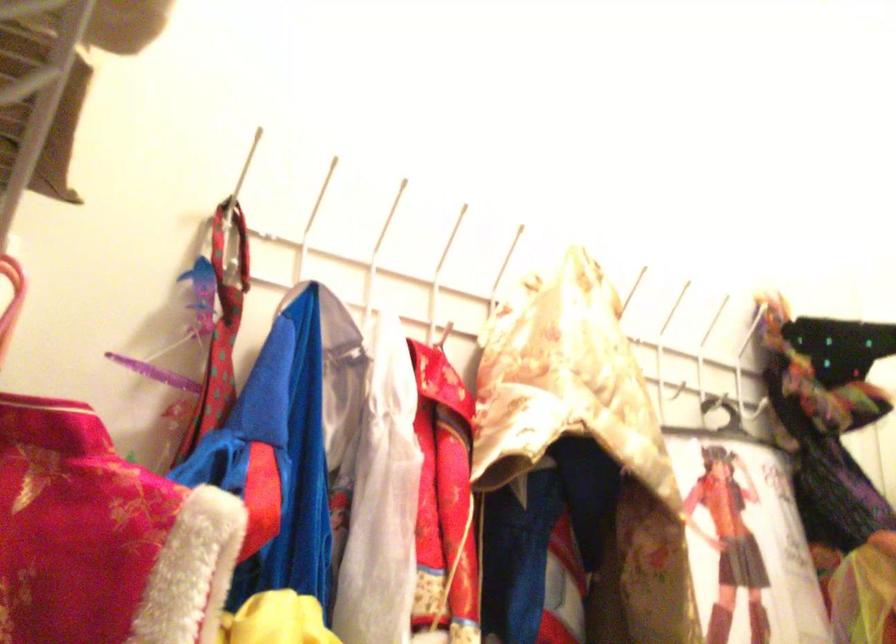
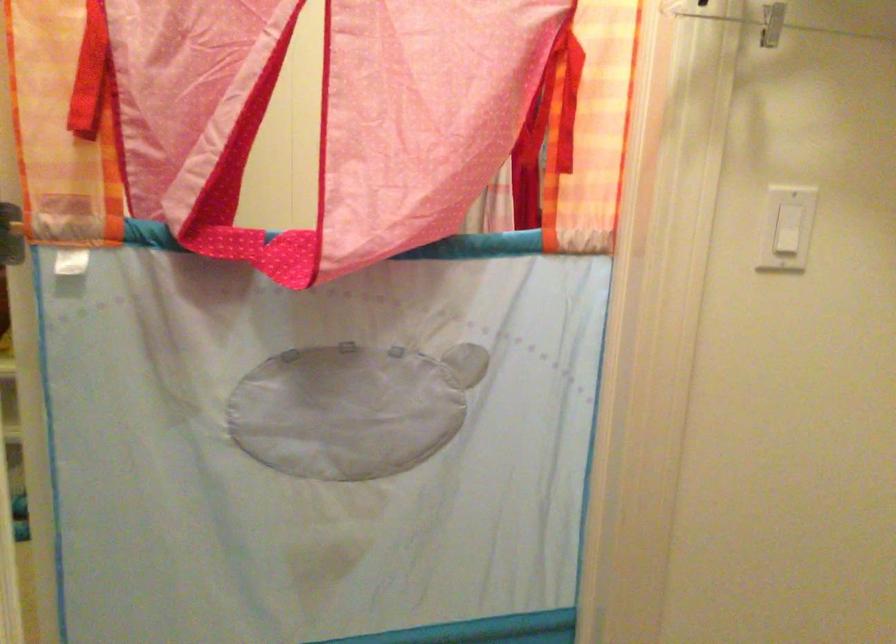
Based on the continuous images, in which direction is the camera rotating?

The rotation direction of the camera is right-down.